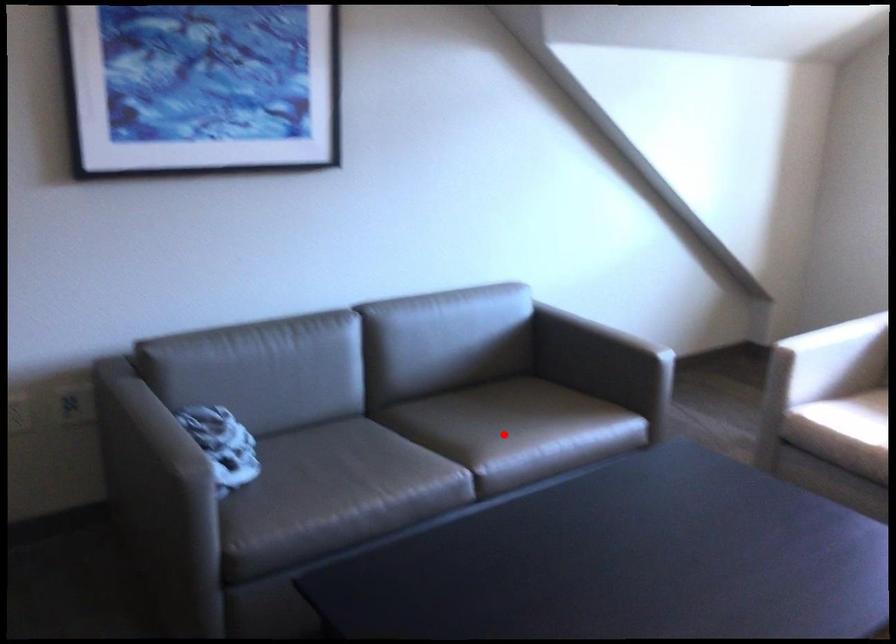
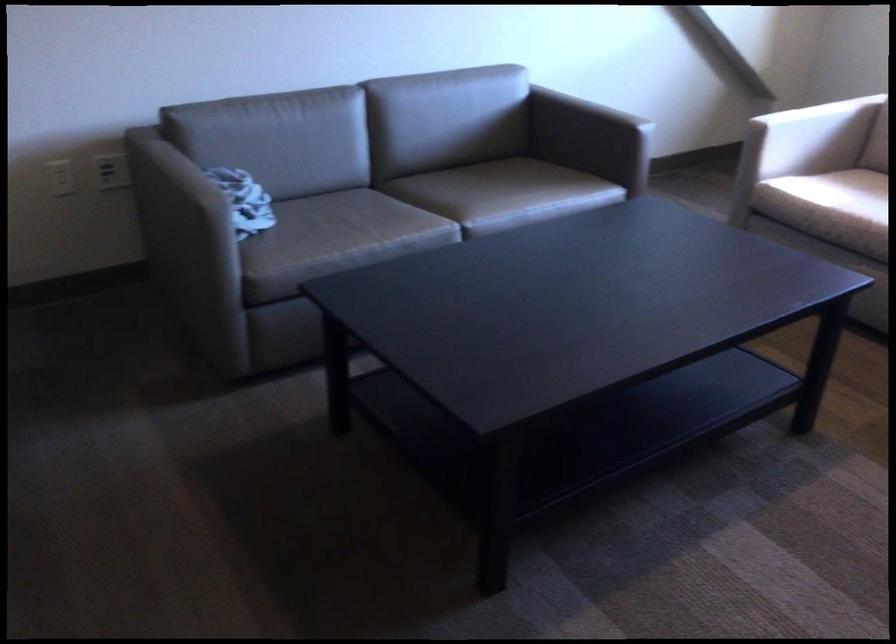
Locate, in the second image, the point that corresponds to the highlighted location in the first image.

(489, 194)